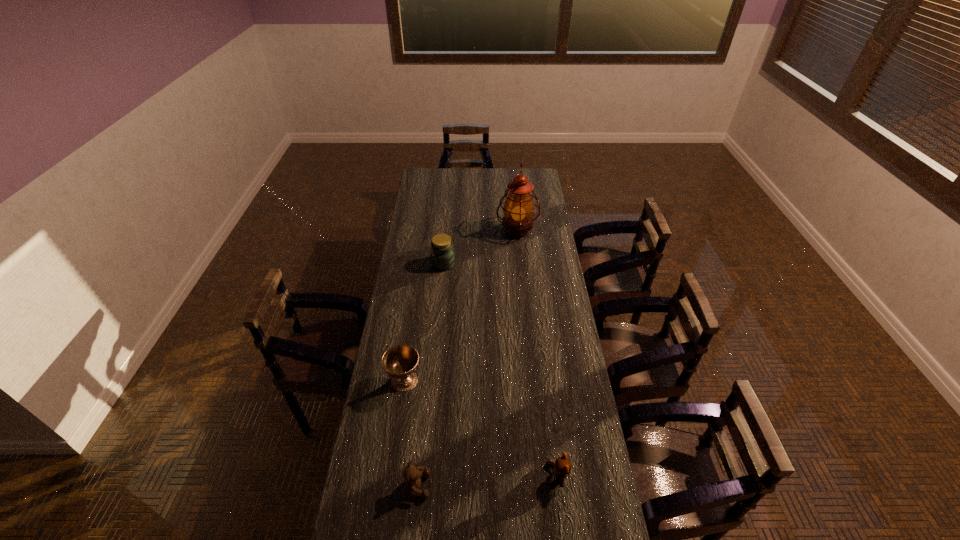
Where is `free space located 0.050m on the front-facing side of the right teddy bear`? The width and height of the screenshot is (960, 540). free space located 0.050m on the front-facing side of the right teddy bear is located at coordinates (531, 476).

The image size is (960, 540). In order to click on vacant space located on the front-facing side of the right teddy bear in this screenshot , I will do [x=470, y=476].

Image resolution: width=960 pixels, height=540 pixels. I want to click on blank area located 0.210m on the front-facing side of the right teddy bear, so click(x=480, y=476).

Where is `jar present at the left edge`? The image size is (960, 540). jar present at the left edge is located at coordinates (442, 254).

Where is `chalice present at the left edge`? chalice present at the left edge is located at coordinates (400, 362).

The height and width of the screenshot is (540, 960). In order to click on teddy bear present at the left edge in this screenshot , I will do (x=412, y=475).

You are a GUI agent. You are given a task and a screenshot of the screen. Output one action in this format:
    pyautogui.click(x=<x>, y=<y>)
    Task: Click on the oil lamp located at the right edge
    This screenshot has width=960, height=540.
    Given the screenshot: What is the action you would take?
    pyautogui.click(x=518, y=209)

The width and height of the screenshot is (960, 540). Identify the location of teddy bear that is at the right edge. (562, 466).

Where is `vacant space at the left edge of the desktop`? The image size is (960, 540). vacant space at the left edge of the desktop is located at coordinates (425, 192).

The height and width of the screenshot is (540, 960). I want to click on vacant space at the right edge, so click(546, 289).